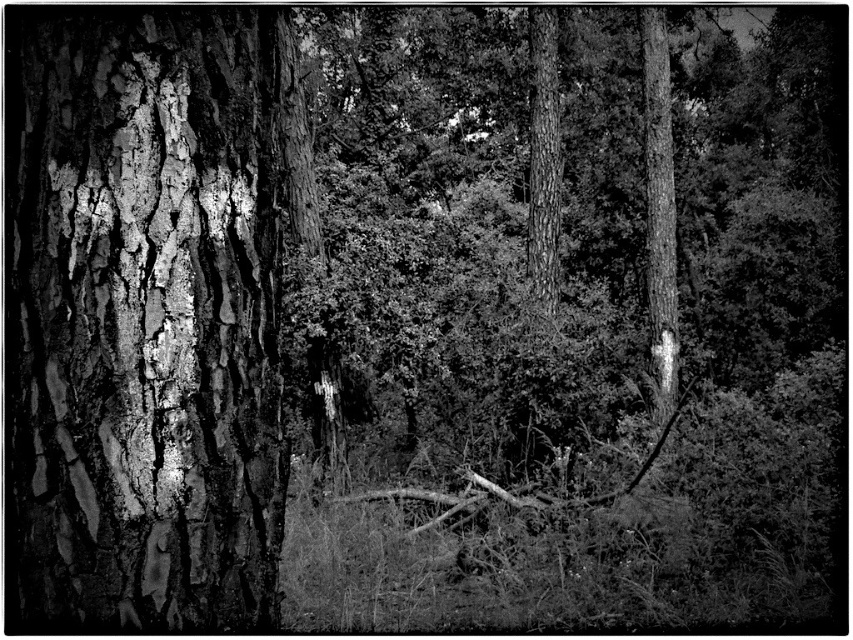
Based on the scene description, where exactly is the cracked bark tree trunk at left located in the image?

The cracked bark tree trunk at left is located at point (146, 317).

You are a hiker who wants to climb the tree trunks in the forest. Which tree trunk, the cracked bark tree trunk at left or the smooth bark tree trunk at right, is easier to climb?

The cracked bark tree trunk at left is positioned under the smooth bark tree trunk at right, so the cracked bark tree trunk at left is easier to climb because its rough texture provides better grip and footholds compared to the smooth one.

You are a hiker trying to identify two trees in the forest. You see the cracked bark tree trunk at left and the smooth bark tree trunk at right. Which tree trunk is nearer to you?

The cracked bark tree trunk at left is closer to the viewer than the smooth bark tree trunk at right, so the cracked bark tree trunk at left is nearer to you.